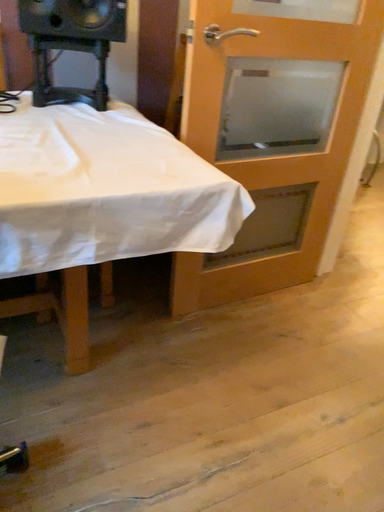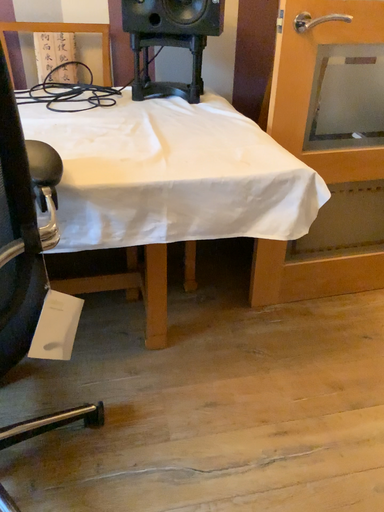
Question: How did the camera likely rotate when shooting the video?

Choices:
 (A) rotated left
 (B) rotated right

Answer: (A)